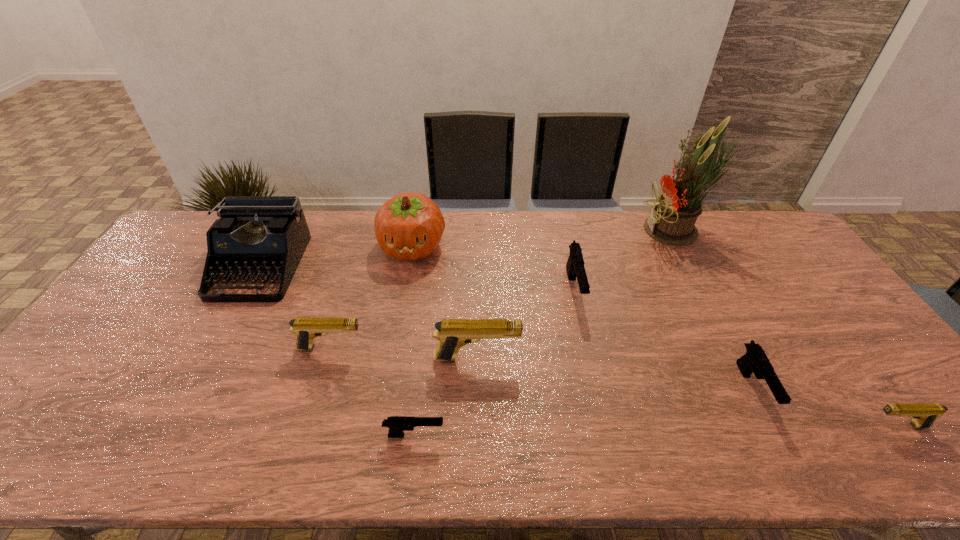
What are the coordinates of `the tallest object` in the screenshot? It's located at (671, 221).

Where is `the eighth shortest object`? Image resolution: width=960 pixels, height=540 pixels. the eighth shortest object is located at coordinates (409, 226).

Identify the location of green pumpkin. The image size is (960, 540). (409, 226).

Where is `black typewriter`? black typewriter is located at coordinates (260, 235).

Image resolution: width=960 pixels, height=540 pixels. What are the coordinates of `the leftmost object` in the screenshot? It's located at (260, 235).

I want to click on the second tan pistol from left to right, so click(452, 334).

I want to click on the second nearest tan pistol, so click(452, 334).

Find the location of `the third pistol from right to left`. the third pistol from right to left is located at coordinates (575, 267).

I want to click on the farthest pistol, so click(x=575, y=267).

Locate an element on the screen. This screenshot has height=540, width=960. the fifth farthest object is located at coordinates (306, 329).